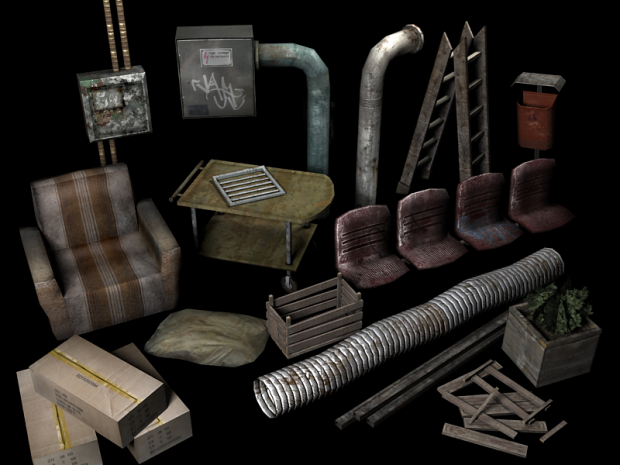
The height and width of the screenshot is (465, 620). Find the location of `seats`. seats is located at coordinates (539, 214), (494, 229), (426, 237), (381, 262), (102, 260).